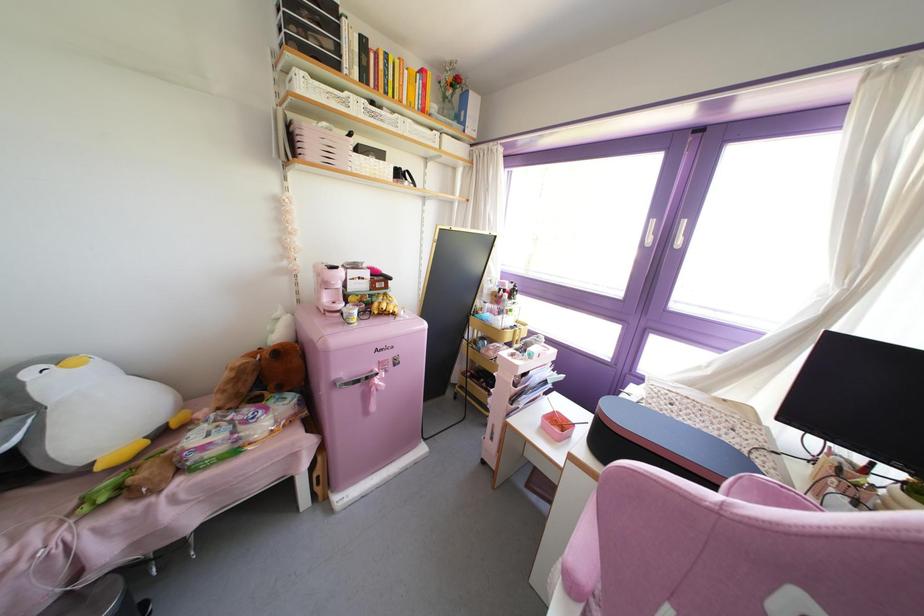
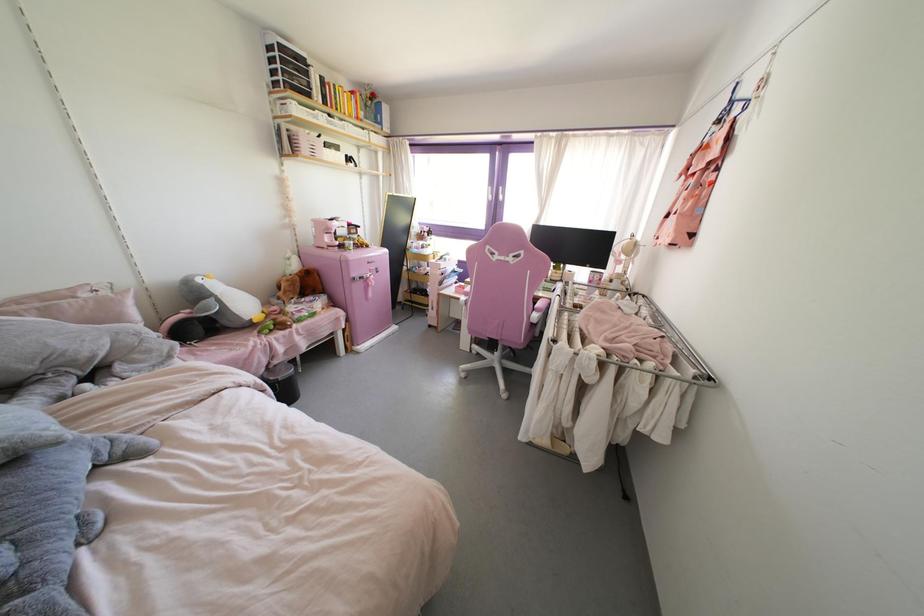
The point at [394,363] is marked in the first image. Where is the corresponding point in the second image?

(377, 272)